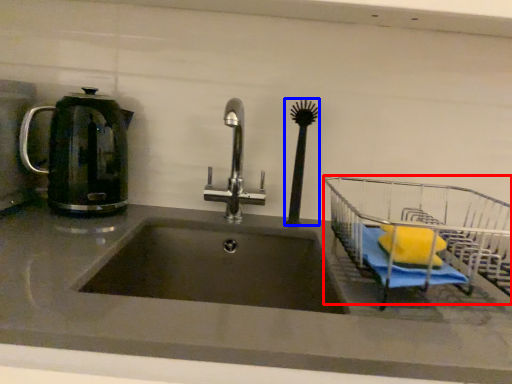
Question: Which point is closer to the camera, cart (highlighted by a red box) or brush (highlighted by a blue box)?

Choices:
 (A) cart
 (B) brush

Answer: (A)